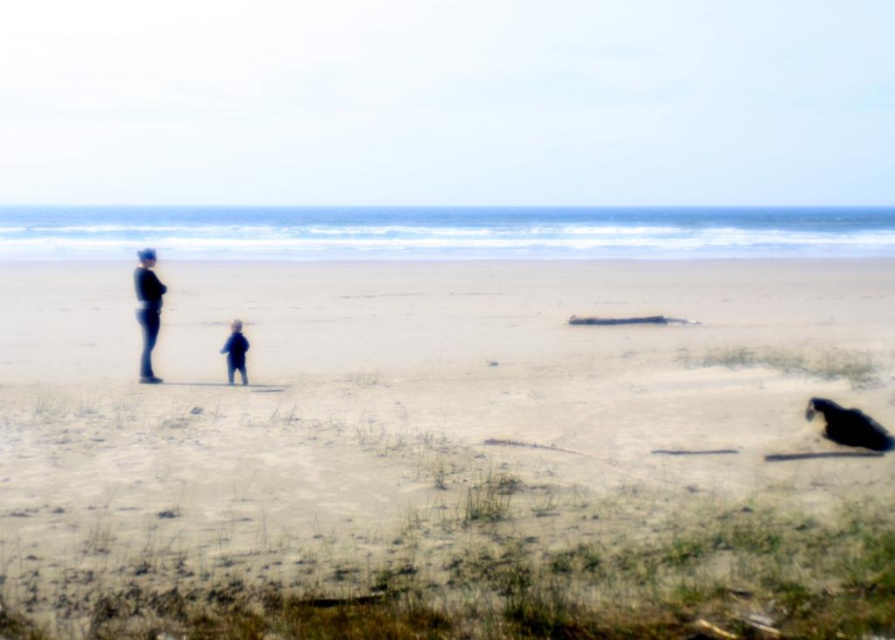
From the picture: Who is lower down, smooth sand beach at center or black fur dog at lower right?

black fur dog at lower right

Is point (493, 301) closer to camera compared to point (891, 445)?

No, it is not.

At what (x,y) coordinates should I click in order to perform the action: click on smooth sand beach at center. Please return your answer as a coordinate pair (x, y). Image resolution: width=895 pixels, height=640 pixels. Looking at the image, I should click on (448, 452).

Is smooth sand beach at center below smooth black figure at center?

Actually, smooth sand beach at center is above smooth black figure at center.

Who is more distant from viewer, (444,288) or (229,355)?

Point (444,288)

Where is `smooth sand beach at center`? smooth sand beach at center is located at coordinates (448, 452).

Between black fur dog at lower right and matte black figure at left, which one has more height?

matte black figure at left

From the picture: Does black fur dog at lower right appear over matte black figure at left?

Incorrect, black fur dog at lower right is not positioned above matte black figure at left.

This screenshot has width=895, height=640. Find the location of `black fur dog at lower right`. black fur dog at lower right is located at coordinates (848, 426).